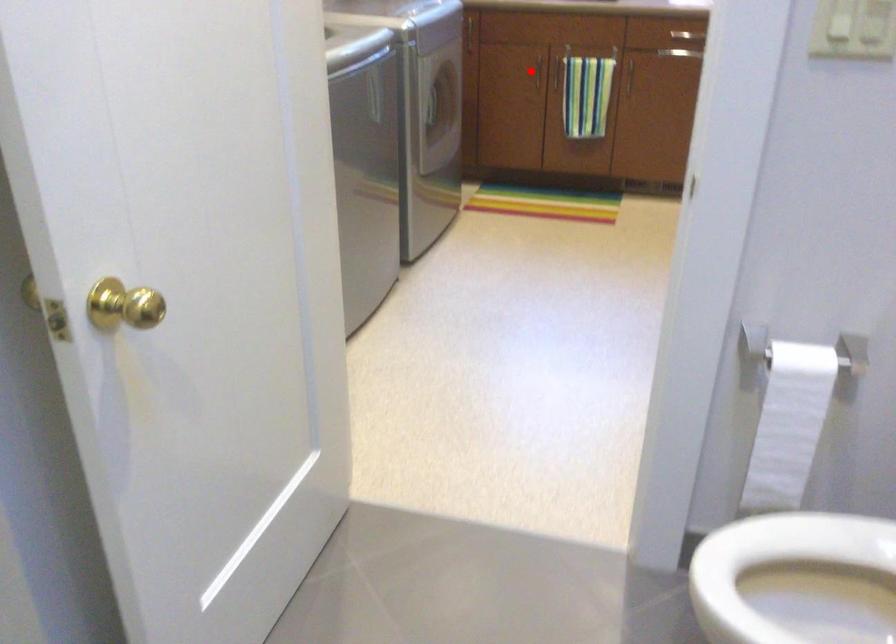
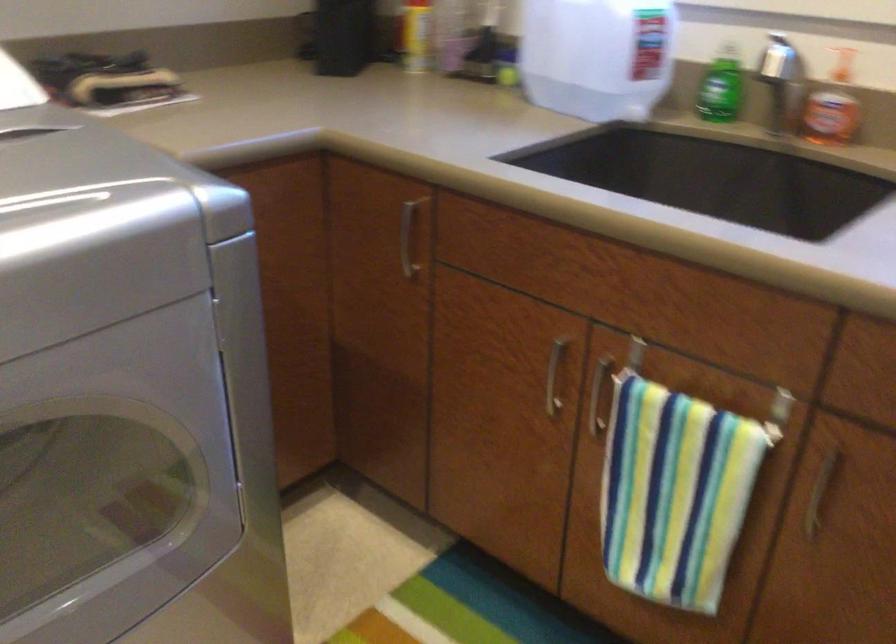
Find the pixel in the second image that matches the highlighted location in the first image.

(554, 375)